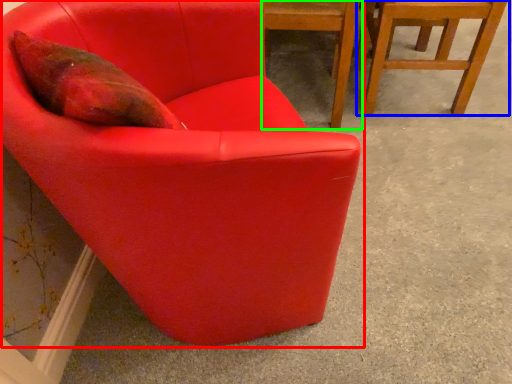
Question: Which object is the farthest from chair (highlighted by a red box)? Choose among these: chair (highlighted by a blue box) or chair (highlighted by a green box).

Choices:
 (A) chair
 (B) chair

Answer: (A)